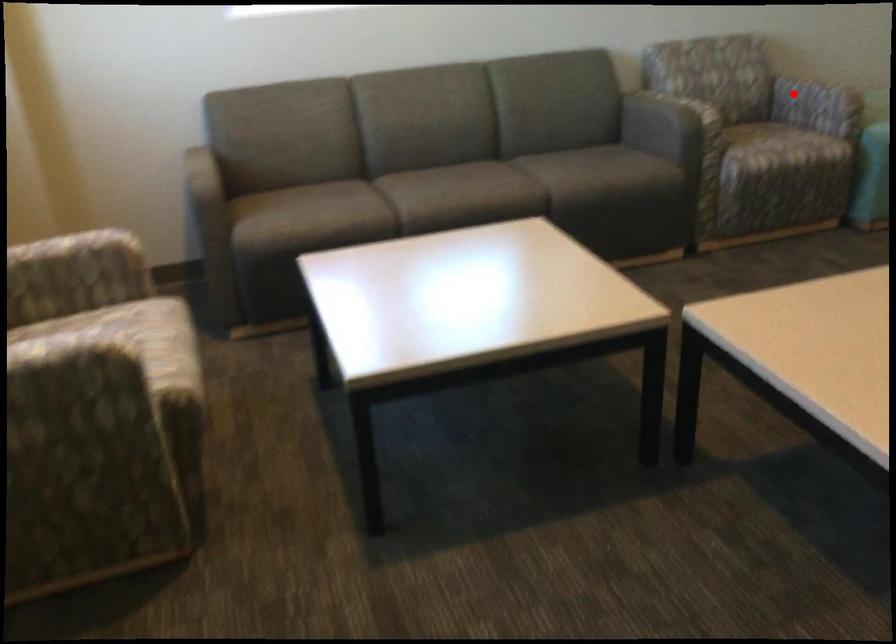
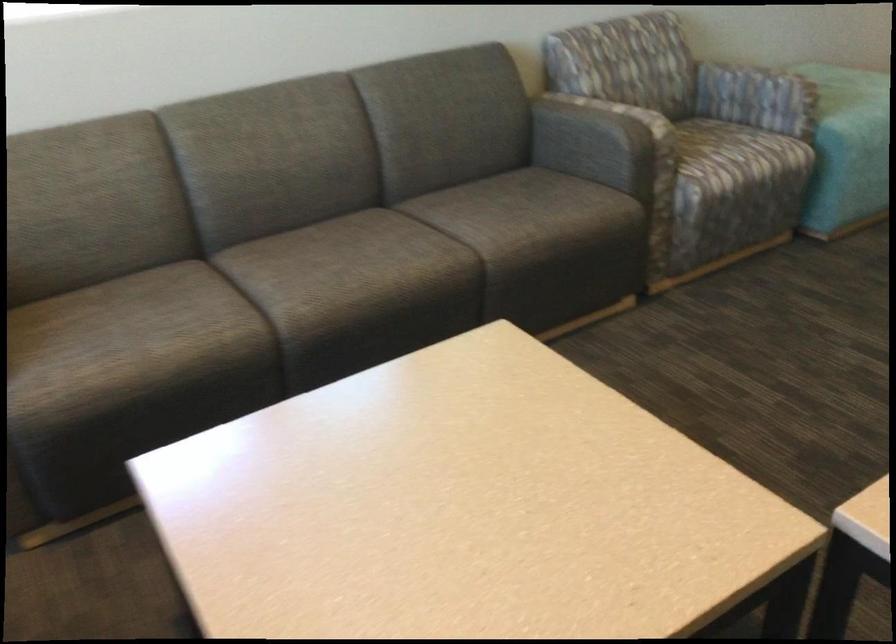
In the second image, find the point that corresponds to the highlighted location in the first image.

(728, 84)